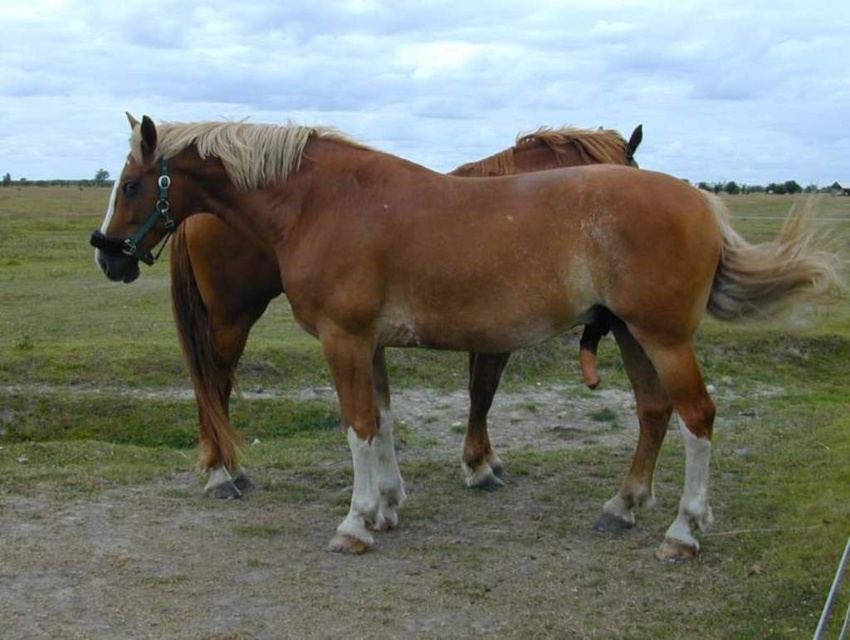
You are a photographer trying to capture both horses in a single frame. The camera you are using has a limited field of view. Given that the brown glossy horse at center is represented by point (468,275), can you confirm if the other horse is within the camera frame?

The brown glossy horse at center is represented by point (468,275). Since the other horse is partially obscured behind the first, it is likely still within the camera frame unless the obscuring is severe enough to block it entirely.

You are a farmer checking the height of your horses. You have a stable door that is 1.8 meters tall. Can both the brown glossy horse at center and the blonde silky tail at right pass through the door without bending?

The brown glossy horse at center is taller than the blonde silky tail at right. Since the stable door is 1.8 meters tall, if the taller brown glossy horse at center can pass without bending, then the shorter blonde silky tail at right can also pass. However, if the brown glossy horse at center is taller than 1.8 meters, neither can pass without bending. The exact height of the horses is not provided, so it depends on their actual heights compared to the door.